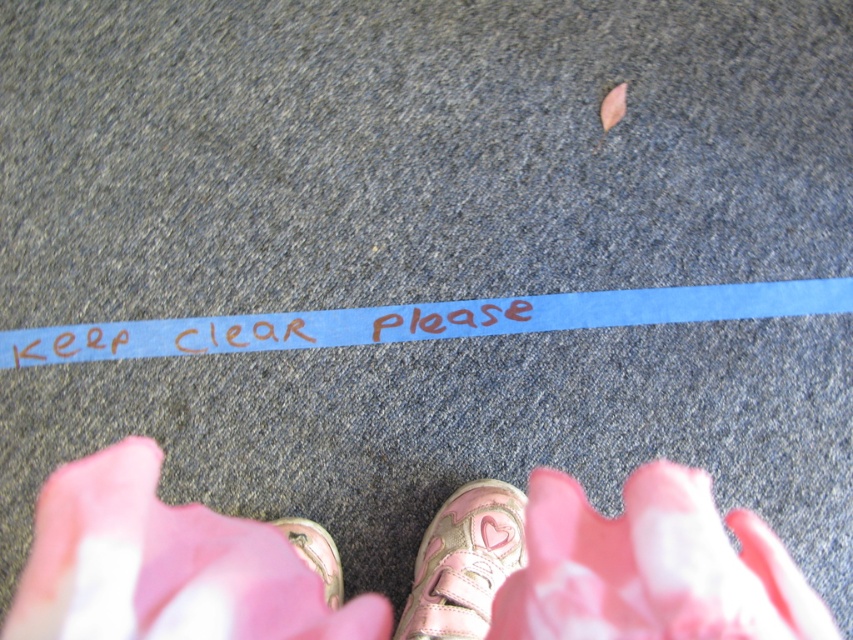
Question: Which object appears farthest from the camera in this image?

Choices:
 (A) pink glittery sneaker at lower center
 (B) blue paper strip at center

Answer: (B)

Question: Does blue paper strip at center appear under pink glittery sneaker at lower center?

Choices:
 (A) yes
 (B) no

Answer: (B)

Question: Which point is farther from the camera taking this photo?

Choices:
 (A) (340, 568)
 (B) (28, 362)

Answer: (B)

Question: Considering the relative positions of pink glittery sneaker at lower center and metallic pink shoe at lower center in the image provided, where is pink glittery sneaker at lower center located with respect to metallic pink shoe at lower center?

Choices:
 (A) below
 (B) above

Answer: (A)

Question: Among these objects, which one is nearest to the camera?

Choices:
 (A) metallic pink shoe at lower center
 (B) pink glittery sneaker at lower center
 (C) blue paper strip at center

Answer: (B)

Question: Does blue paper strip at center have a lesser width compared to metallic pink shoe at lower center?

Choices:
 (A) yes
 (B) no

Answer: (B)